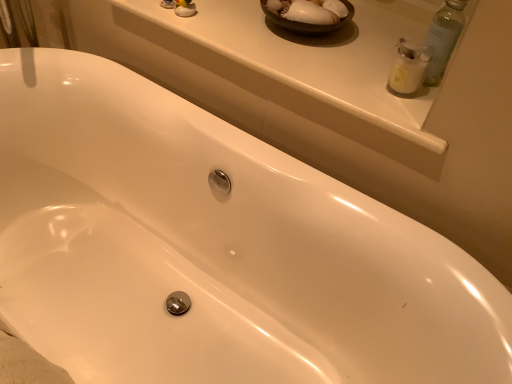
Question: From the image's perspective, is white matte jar at upper right on white glossy window sill at upper center?

Choices:
 (A) yes
 (B) no

Answer: (B)

Question: Can you confirm if white matte jar at upper right is thinner than white glossy window sill at upper center?

Choices:
 (A) yes
 (B) no

Answer: (A)

Question: Does white matte jar at upper right come in front of white glossy window sill at upper center?

Choices:
 (A) no
 (B) yes

Answer: (A)

Question: Considering the relative sizes of white matte jar at upper right and white glossy window sill at upper center in the image provided, is white matte jar at upper right wider than white glossy window sill at upper center?

Choices:
 (A) no
 (B) yes

Answer: (A)

Question: Could you tell me if white matte jar at upper right is facing white glossy window sill at upper center?

Choices:
 (A) yes
 (B) no

Answer: (B)

Question: Does white matte jar at upper right have a smaller size compared to white glossy window sill at upper center?

Choices:
 (A) no
 (B) yes

Answer: (B)

Question: Is white glossy window sill at upper center oriented towards white matte jar at upper right?

Choices:
 (A) no
 (B) yes

Answer: (A)

Question: Can you confirm if white glossy window sill at upper center is shorter than white matte jar at upper right?

Choices:
 (A) yes
 (B) no

Answer: (A)

Question: From the image's perspective, is white glossy window sill at upper center on top of white matte jar at upper right?

Choices:
 (A) no
 (B) yes

Answer: (B)

Question: Is white glossy window sill at upper center positioned with its back to white matte jar at upper right?

Choices:
 (A) yes
 (B) no

Answer: (B)

Question: Considering the relative positions of white glossy window sill at upper center and white matte jar at upper right in the image provided, is white glossy window sill at upper center behind white matte jar at upper right?

Choices:
 (A) yes
 (B) no

Answer: (B)

Question: From a real-world perspective, is white glossy window sill at upper center physically above white matte jar at upper right?

Choices:
 (A) yes
 (B) no

Answer: (B)

Question: Considering the positions of white glossy window sill at upper center and white matte jar at upper right in the image, is white glossy window sill at upper center bigger or smaller than white matte jar at upper right?

Choices:
 (A) small
 (B) big

Answer: (B)